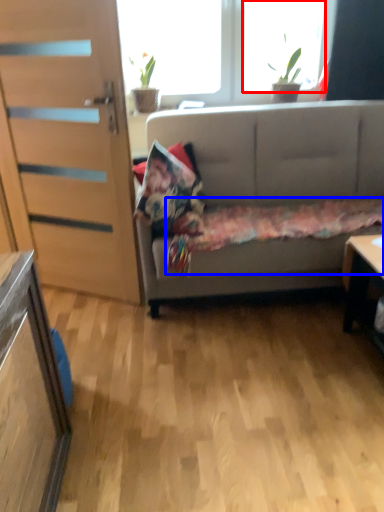
Question: Which object appears farthest to the camera in this image, window (highlighted by a red box) or bedding (highlighted by a blue box)?

Choices:
 (A) window
 (B) bedding

Answer: (A)